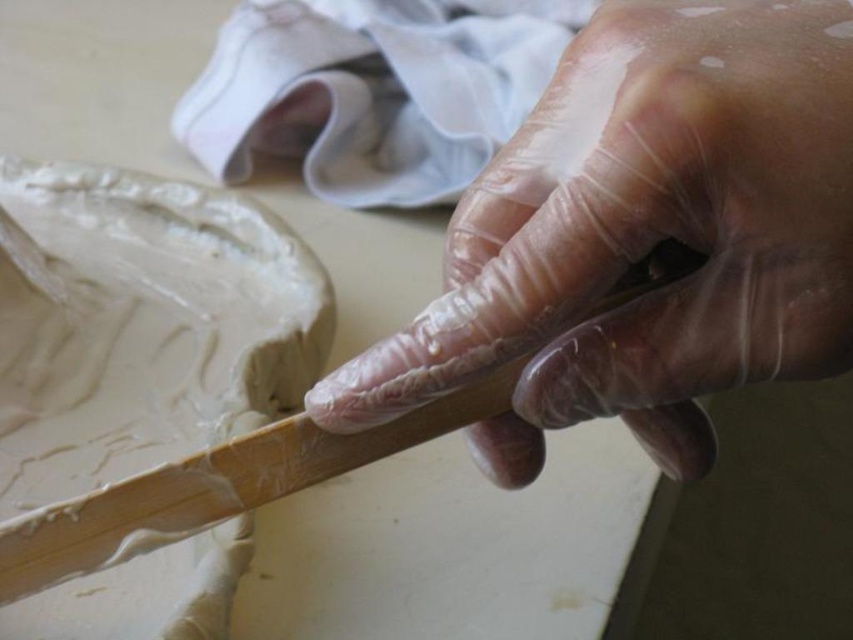
Question: In this image, where is transparent plastic hand at center located relative to white clay at upper left?

Choices:
 (A) right
 (B) left

Answer: (A)

Question: Does transparent plastic hand at center appear on the left side of white clay at upper left?

Choices:
 (A) yes
 (B) no

Answer: (B)

Question: Among these objects, which one is nearest to the camera?

Choices:
 (A) transparent plastic hand at center
 (B) white clay at upper left

Answer: (A)

Question: Which object is farther from the camera taking this photo?

Choices:
 (A) white clay at upper left
 (B) transparent plastic hand at center

Answer: (A)

Question: Is transparent plastic hand at center above white clay at upper left?

Choices:
 (A) no
 (B) yes

Answer: (B)